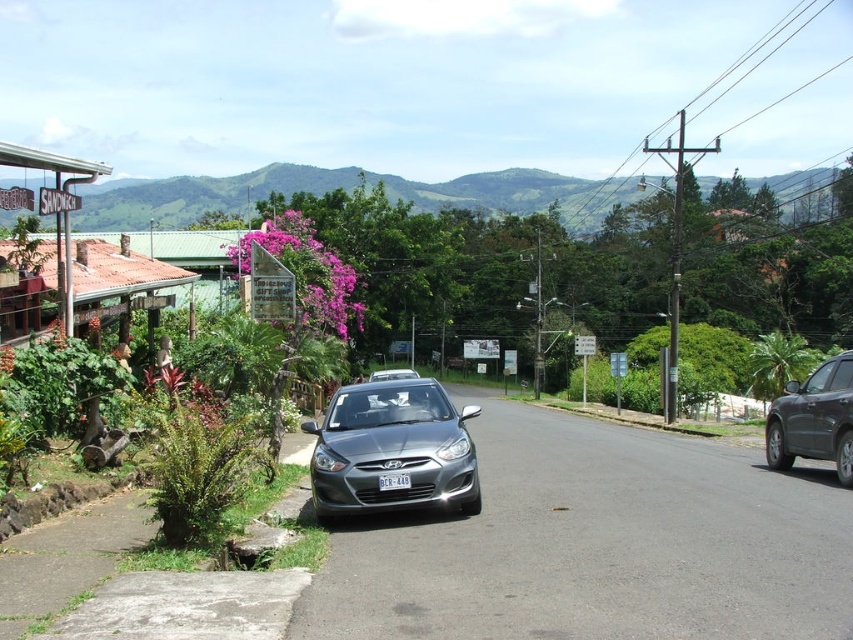
You are a tourist standing on the sidewalk next to the satin metallic sedan at center. You want to take a photo of the green leafy mountain at upper center without the sedan blocking the view. Which direction should you move to ensure the sedan is out of frame?

The green leafy mountain at upper center is positioned on the right side of the satin metallic sedan at center. To avoid the sedan blocking the view, move to the right side of the sedan so that the mountain is no longer obscured.